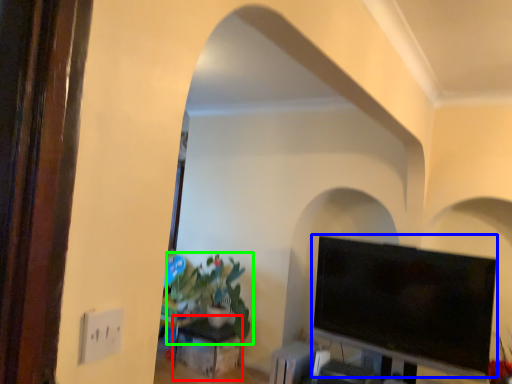
Question: Based on their relative distances, which object is farther from table (highlighted by a red box)? Choose from television (highlighted by a blue box) and houseplant (highlighted by a green box).

Choices:
 (A) television
 (B) houseplant

Answer: (A)